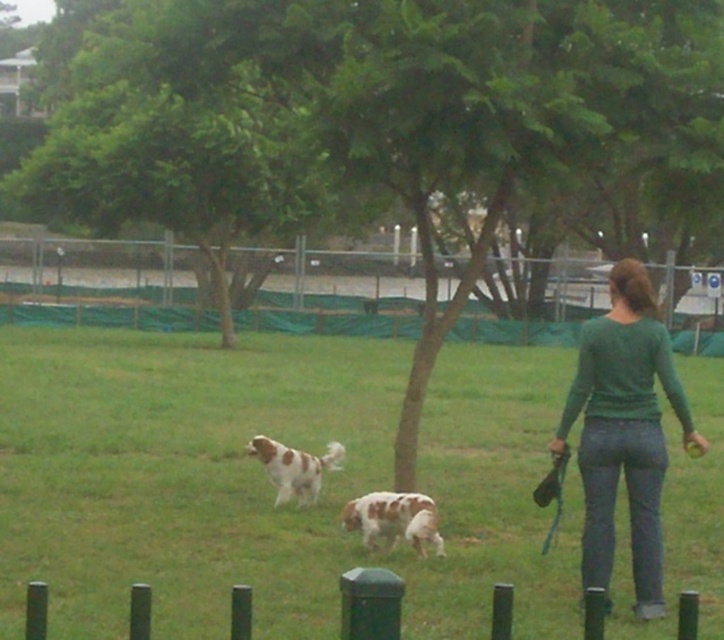
Question: Does green grass at center appear on the left side of green matte shirt at center?

Choices:
 (A) yes
 (B) no

Answer: (A)

Question: Does green matte shirt at center have a greater width compared to spotted fur dog at center?

Choices:
 (A) no
 (B) yes

Answer: (B)

Question: Does green grass at center appear over spotted fur dog at center?

Choices:
 (A) no
 (B) yes

Answer: (B)

Question: Which point appears closest to the camera in this image?

Choices:
 (A) (618, 388)
 (B) (151, 392)
 (C) (374, 522)
 (D) (269, 465)

Answer: (A)

Question: Based on their relative distances, which object is nearer to the spotted fur dog at center?

Choices:
 (A) green matte shirt at center
 (B) white speckled fur dog at center
 (C) green grass at center

Answer: (A)

Question: Which point is farther to the camera?

Choices:
 (A) green matte shirt at center
 (B) green grass at center
 (C) spotted fur dog at center
 (D) white speckled fur dog at center

Answer: (D)